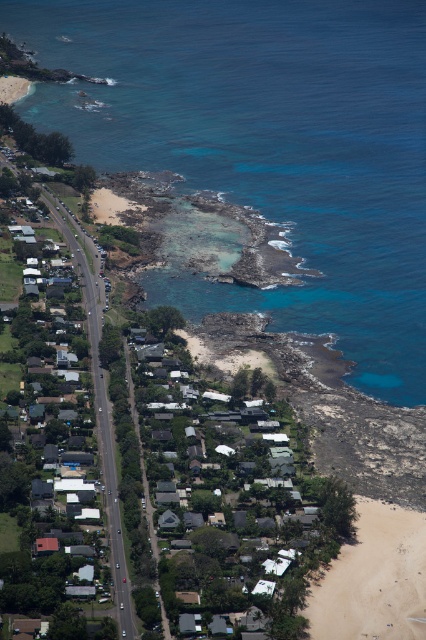
Question: Does blue clear water at center appear on the left side of light brown sand at lower right?

Choices:
 (A) no
 (B) yes

Answer: (B)

Question: Which object appears farthest from the camera in this image?

Choices:
 (A) light brown sand at lower right
 (B) blue clear water at center

Answer: (B)

Question: Is blue clear water at center wider than light brown sand at lower right?

Choices:
 (A) yes
 (B) no

Answer: (A)

Question: Which object appears closest to the camera in this image?

Choices:
 (A) light brown sand at lower right
 (B) blue clear water at center

Answer: (A)

Question: Which point is closer to the camera?

Choices:
 (A) blue clear water at center
 (B) light brown sand at lower right

Answer: (B)

Question: Does blue clear water at center have a lesser width compared to light brown sand at lower right?

Choices:
 (A) yes
 (B) no

Answer: (B)